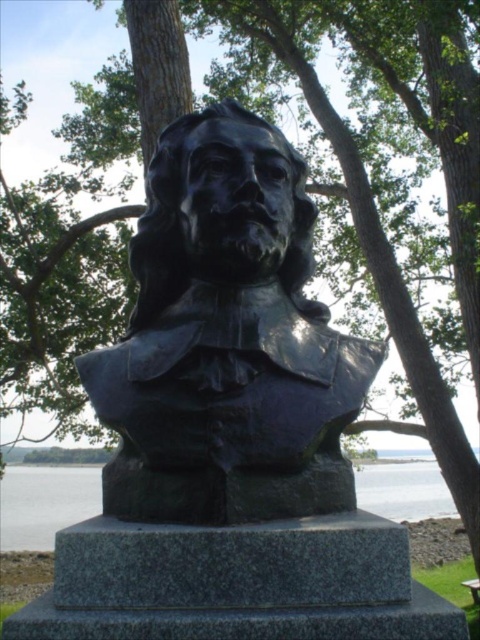
Question: Among these points, which one is farthest from the camera?

Choices:
 (A) (275, 200)
 (B) (446, 493)

Answer: (B)

Question: Which point is closer to the camera?

Choices:
 (A) tap(420, 509)
 (B) tap(157, 202)

Answer: (B)

Question: Does black polished bust at center come in front of transparent water at base center?

Choices:
 (A) no
 (B) yes

Answer: (B)

Question: From the image, what is the correct spatial relationship of black polished bust at center in relation to transparent water at base center?

Choices:
 (A) below
 (B) above

Answer: (B)

Question: Can you confirm if black polished bust at center is wider than transparent water at base center?

Choices:
 (A) no
 (B) yes

Answer: (A)